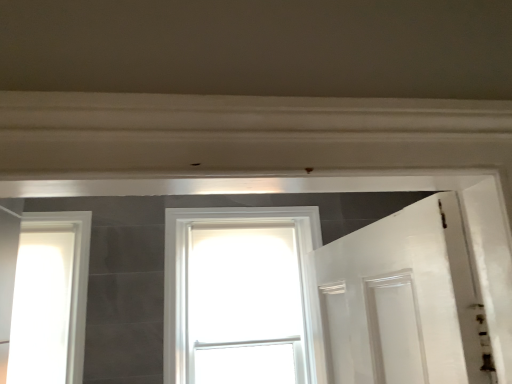
Image resolution: width=512 pixels, height=384 pixels. Describe the element at coordinates (50, 299) in the screenshot. I see `white glossy window at left, which ranks as the 2th window in right-to-left order` at that location.

I want to click on white glossy window at left, which ranks as the 2th window in right-to-left order, so click(x=50, y=299).

Where is `white glossy window at center, which appears as the 2th window when viewed from the left`? white glossy window at center, which appears as the 2th window when viewed from the left is located at coordinates (187, 265).

What do you see at coordinates (187, 265) in the screenshot? I see `white glossy window at center, which appears as the 2th window when viewed from the left` at bounding box center [187, 265].

Locate an element on the screen. white glossy window at left, the first window in the left-to-right sequence is located at coordinates pyautogui.click(x=50, y=299).

Considering the positions of objects white glossy window at center, which appears as the 1th window when viewed from the right, and white glossy window at left, which ranks as the 2th window in right-to-left order, in the image provided, who is more to the right, white glossy window at center, which appears as the 1th window when viewed from the right, or white glossy window at left, which ranks as the 2th window in right-to-left order,?

From the viewer's perspective, white glossy window at center, which appears as the 1th window when viewed from the right, appears more on the right side.

Which object is further away from the camera, white glossy window at center, which appears as the 1th window when viewed from the right, or white glossy window at left, the first window in the left-to-right sequence?

white glossy window at center, which appears as the 1th window when viewed from the right, is further away from the camera.

Which is nearer, (170, 360) or (22, 377)?

Point (170, 360) is farther from the camera than point (22, 377).

From the image's perspective, is white glossy window at center, which appears as the 1th window when viewed from the right, below white glossy window at left, which ranks as the 2th window in right-to-left order?

Indeed, from the image's perspective, white glossy window at center, which appears as the 1th window when viewed from the right, is shown beneath white glossy window at left, which ranks as the 2th window in right-to-left order.

From a real-world perspective, which is physically above, white glossy window at center, which appears as the 2th window when viewed from the left, or white glossy window at left, the first window in the left-to-right sequence?

Answer: white glossy window at left, the first window in the left-to-right sequence.

Considering the sizes of white glossy window at center, which appears as the 1th window when viewed from the right, and white glossy window at left, the first window in the left-to-right sequence, in the image, is white glossy window at center, which appears as the 1th window when viewed from the right, wider or thinner than white glossy window at left, the first window in the left-to-right sequence,?

Clearly, white glossy window at center, which appears as the 1th window when viewed from the right, has more width compared to white glossy window at left, the first window in the left-to-right sequence.

Can you confirm if white glossy window at center, which appears as the 1th window when viewed from the right, is shorter than white glossy window at left, which ranks as the 2th window in right-to-left order?

Incorrect, the height of white glossy window at center, which appears as the 1th window when viewed from the right, does not fall short of that of white glossy window at left, which ranks as the 2th window in right-to-left order.

Which of these two, white glossy window at center, which appears as the 1th window when viewed from the right, or white glossy window at left, the first window in the left-to-right sequence, is smaller?

With smaller size is white glossy window at left, the first window in the left-to-right sequence.

Is white glossy window at left, which ranks as the 2th window in right-to-left order, completely or partially inside white glossy window at center, which appears as the 2th window when viewed from the left?

No, white glossy window at left, which ranks as the 2th window in right-to-left order, is located outside of white glossy window at center, which appears as the 2th window when viewed from the left.

Are white glossy window at center, which appears as the 2th window when viewed from the left, and white glossy window at left, the first window in the left-to-right sequence, making contact?

white glossy window at center, which appears as the 2th window when viewed from the left, is not next to white glossy window at left, the first window in the left-to-right sequence, and they're not touching.

Is white glossy window at center, which appears as the 2th window when viewed from the left, facing towards white glossy window at left, the first window in the left-to-right sequence?

No, white glossy window at center, which appears as the 2th window when viewed from the left, does not turn towards white glossy window at left, the first window in the left-to-right sequence.

At what (x,y) coordinates should I click in order to perform the action: click on window that appears above the white glossy window at center, which appears as the 2th window when viewed from the left (from the image's perspective). Please return your answer as a coordinate pair (x, y). Image resolution: width=512 pixels, height=384 pixels. Looking at the image, I should click on 50,299.

Does white glossy window at left, the first window in the left-to-right sequence, appear on the right side of white glossy window at center, which appears as the 2th window when viewed from the left?

In fact, white glossy window at left, the first window in the left-to-right sequence, is to the left of white glossy window at center, which appears as the 2th window when viewed from the left.

From the picture: Between white glossy window at left, the first window in the left-to-right sequence, and white glossy window at center, which appears as the 1th window when viewed from the right, which one is positioned behind?

white glossy window at center, which appears as the 1th window when viewed from the right.

Considering the points (66, 227) and (170, 363), which point is behind, point (66, 227) or point (170, 363)?

The point (66, 227) is farther.

From the image's perspective, would you say white glossy window at left, which ranks as the 2th window in right-to-left order, is positioned over white glossy window at center, which appears as the 1th window when viewed from the right?

Yes, from the image's perspective, white glossy window at left, which ranks as the 2th window in right-to-left order, is over white glossy window at center, which appears as the 1th window when viewed from the right.

From a real-world perspective, is white glossy window at left, the first window in the left-to-right sequence, above or below white glossy window at center, which appears as the 2th window when viewed from the left?

white glossy window at left, the first window in the left-to-right sequence, is situated higher than white glossy window at center, which appears as the 2th window when viewed from the left, in the real world.

Which of these two, white glossy window at left, the first window in the left-to-right sequence, or white glossy window at center, which appears as the 1th window when viewed from the right, is wider?

Wider between the two is white glossy window at center, which appears as the 1th window when viewed from the right.

Considering the relative sizes of white glossy window at left, the first window in the left-to-right sequence, and white glossy window at center, which appears as the 2th window when viewed from the left, in the image provided, is white glossy window at left, the first window in the left-to-right sequence, taller than white glossy window at center, which appears as the 2th window when viewed from the left,?

No.

Looking at the image, does white glossy window at left, which ranks as the 2th window in right-to-left order, seem bigger or smaller compared to white glossy window at center, which appears as the 1th window when viewed from the right?

Considering their sizes, white glossy window at left, which ranks as the 2th window in right-to-left order, takes up less space than white glossy window at center, which appears as the 1th window when viewed from the right.

Is white glossy window at center, which appears as the 2th window when viewed from the left, surrounded by white glossy window at left, which ranks as the 2th window in right-to-left order?

No, white glossy window at left, which ranks as the 2th window in right-to-left order, does not contain white glossy window at center, which appears as the 2th window when viewed from the left.

From the picture: Is white glossy window at left, the first window in the left-to-right sequence, far from white glossy window at center, which appears as the 1th window when viewed from the right?

No, white glossy window at left, the first window in the left-to-right sequence, is not far away from white glossy window at center, which appears as the 1th window when viewed from the right.

Is white glossy window at left, which ranks as the 2th window in right-to-left order, turned away from white glossy window at center, which appears as the 2th window when viewed from the left?

white glossy window at left, which ranks as the 2th window in right-to-left order, does not have its back to white glossy window at center, which appears as the 2th window when viewed from the left.

Can you tell me how much white glossy window at left, which ranks as the 2th window in right-to-left order, and white glossy window at center, which appears as the 1th window when viewed from the right, differ in facing direction?

white glossy window at left, which ranks as the 2th window in right-to-left order, and white glossy window at center, which appears as the 1th window when viewed from the right, are facing 0.904 degrees away from each other.

The image size is (512, 384). In order to click on window in front of the white glossy window at center, which appears as the 1th window when viewed from the right in this screenshot , I will do `click(50, 299)`.

Image resolution: width=512 pixels, height=384 pixels. I want to click on window below the white glossy window at left, the first window in the left-to-right sequence (from a real-world perspective), so click(187, 265).

Where is `window in front of the white glossy window at center, which appears as the 2th window when viewed from the left`? The width and height of the screenshot is (512, 384). window in front of the white glossy window at center, which appears as the 2th window when viewed from the left is located at coordinates (50, 299).